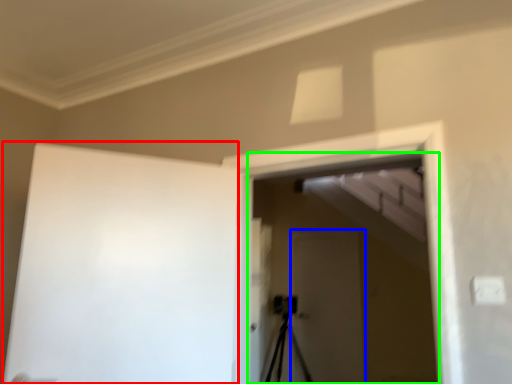
Question: Based on their relative distances, which object is nearer to barn door (highlighted by a red box)? Choose from screen door (highlighted by a blue box) and screen door (highlighted by a green box).

Choices:
 (A) screen door
 (B) screen door

Answer: (B)